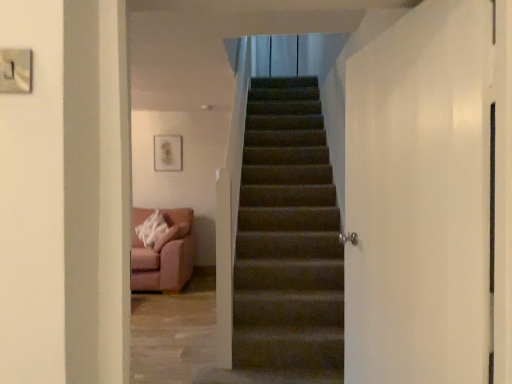
Locate an element on the screen. The height and width of the screenshot is (384, 512). white glossy door at right is located at coordinates (419, 198).

What do you see at coordinates (419, 198) in the screenshot? I see `white glossy door at right` at bounding box center [419, 198].

Measure the distance between point [382,246] and camera.

A distance of 5.19 feet exists between point [382,246] and camera.

Locate an element on the screen. This screenshot has width=512, height=384. white glossy door at right is located at coordinates (419, 198).